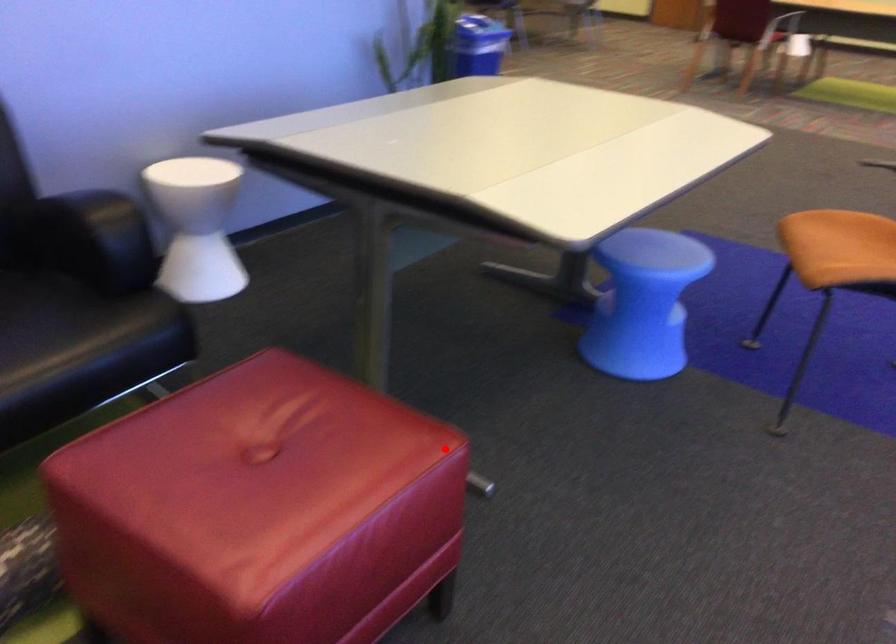
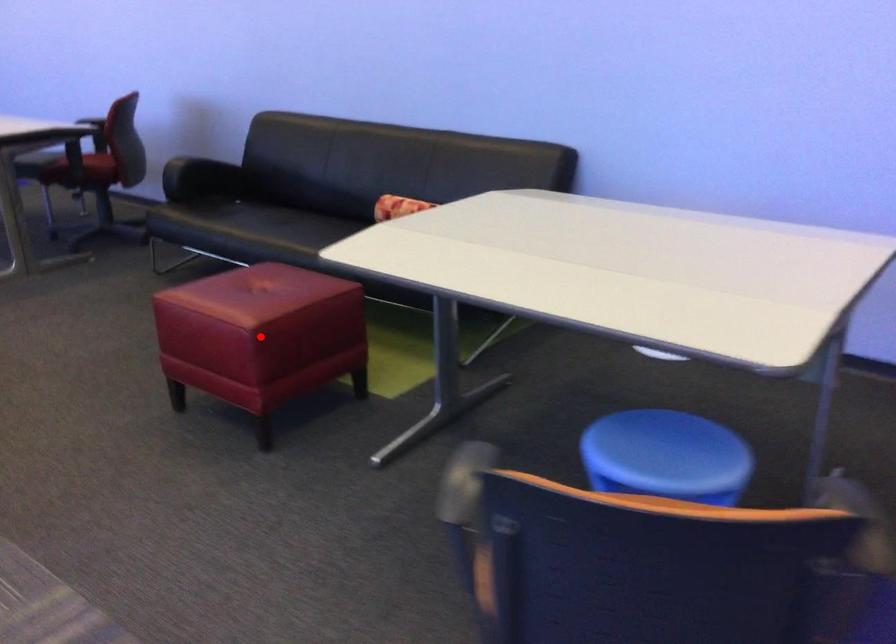
I am providing you with two images of the same scene from different viewpoints. A red point is marked on the first image and another point is marked on the second image. Does the point marked in image1 correspond to the same location as the one in image2?

Yes